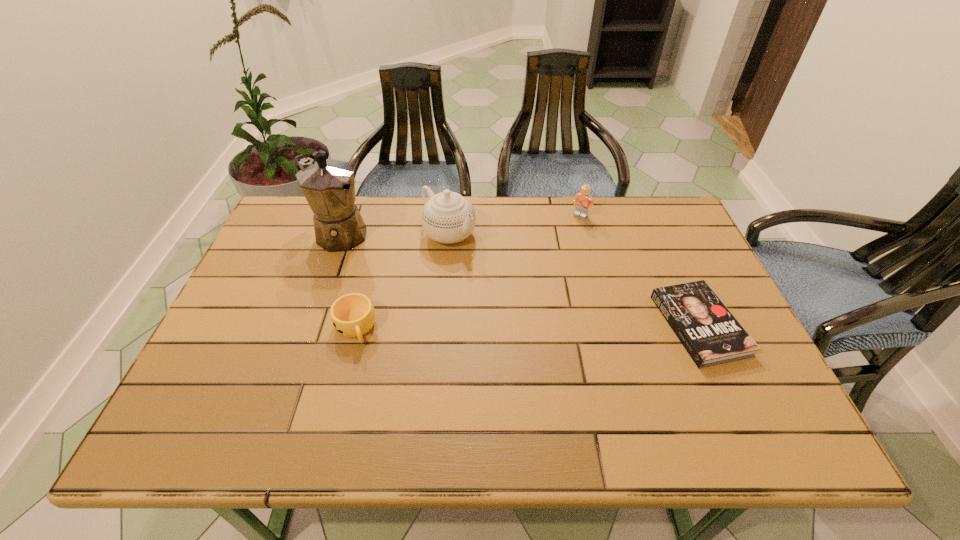
You are a GUI agent. You are given a task and a screenshot of the screen. Output one action in this format:
    pyautogui.click(x=<x>, y=<y>)
    Task: Click on the object that ranks as the second closest to the third shortest object
    The image size is (960, 540).
    Given the screenshot: What is the action you would take?
    pyautogui.click(x=709, y=332)

The height and width of the screenshot is (540, 960). I want to click on blank space that satisfies the following two spatial constraints: 1. on the back side of the fourth tallest object; 2. on the right side of the third shortest object, so click(x=384, y=215).

The height and width of the screenshot is (540, 960). Find the location of `vacant point that satisfies the following two spatial constraints: 1. on the front side of the tallest object; 2. on the left side of the fourth tallest object`. vacant point that satisfies the following two spatial constraints: 1. on the front side of the tallest object; 2. on the left side of the fourth tallest object is located at coordinates (303, 328).

Where is `free space that satisfies the following two spatial constraints: 1. on the back side of the third tallest object; 2. on the right side of the second tallest object`? free space that satisfies the following two spatial constraints: 1. on the back side of the third tallest object; 2. on the right side of the second tallest object is located at coordinates (450, 215).

Find the location of a particular element. This screenshot has height=540, width=960. free space in the image that satisfies the following two spatial constraints: 1. on the front side of the second object from right to left; 2. on the left side of the shortest object is located at coordinates (610, 325).

Where is `free space in the image that satisfies the following two spatial constraints: 1. on the back side of the shortest object; 2. on the left side of the cup`? This screenshot has width=960, height=540. free space in the image that satisfies the following two spatial constraints: 1. on the back side of the shortest object; 2. on the left side of the cup is located at coordinates (355, 325).

The image size is (960, 540). I want to click on free space that satisfies the following two spatial constraints: 1. on the back side of the coffeepot; 2. on the right side of the third tallest object, so click(x=344, y=215).